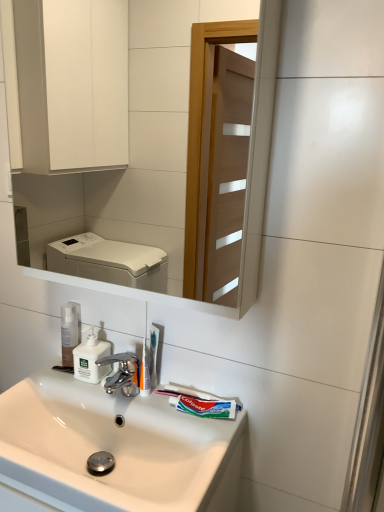
Image resolution: width=384 pixels, height=512 pixels. What do you see at coordinates (70, 331) in the screenshot? I see `transparent plastic pump bottle at center` at bounding box center [70, 331].

At what (x,y) coordinates should I click in order to perform the action: click on transparent plastic pump bottle at center. Please return your answer as a coordinate pair (x, y). Looking at the image, I should click on (70, 331).

Measure the distance between white plastic toothbrush at center, marked as the first toothbrush in a back-to-front arrangement, and camera.

white plastic toothbrush at center, marked as the first toothbrush in a back-to-front arrangement, and camera are 1.14 meters apart from each other.

In the scene shown: Measure the distance between point (158, 335) and camera.

The distance of point (158, 335) from camera is 1.14 meters.

Image resolution: width=384 pixels, height=512 pixels. What do you see at coordinates (144, 374) in the screenshot?
I see `white plastic toothbrush at center, which is the 1th toothbrush from front to back` at bounding box center [144, 374].

Describe the element at coordinates (205, 407) in the screenshot. I see `green matte toothpaste at lower center` at that location.

Find the location of a particular element. transparent plastic pump bottle at center is located at coordinates (70, 331).

Would you consider green matte toothpaste at lower center to be distant from transparent plastic pump bottle at center?

green matte toothpaste at lower center is actually quite close to transparent plastic pump bottle at center.

Considering the relative sizes of green matte toothpaste at lower center and transparent plastic pump bottle at center in the image provided, is green matte toothpaste at lower center smaller than transparent plastic pump bottle at center?

Correct, green matte toothpaste at lower center occupies less space than transparent plastic pump bottle at center.

Does point (216, 401) come in front of point (72, 335)?

That is True.

How distant is green matte toothpaste at lower center from transparent plastic pump bottle at center?

A distance of 38.88 centimeters exists between green matte toothpaste at lower center and transparent plastic pump bottle at center.

Is white glossy mirror at upper center shorter than white glossy sink at lower center?

Incorrect, the height of white glossy mirror at upper center does not fall short of that of white glossy sink at lower center.

Which object is wider, white glossy mirror at upper center or white glossy sink at lower center?

white glossy sink at lower center is wider.

Which is correct: white glossy mirror at upper center is inside white glossy sink at lower center, or outside of it?

white glossy mirror at upper center lies outside white glossy sink at lower center.

From a real-world perspective, relative to white glossy sink at lower center, is white glossy mirror at upper center vertically above or below?

white glossy mirror at upper center is situated higher than white glossy sink at lower center in the real world.

Considering the relative positions of white plastic toothbrush at center, which is the 1th toothbrush from front to back, and transparent plastic pump bottle at center in the image provided, is white plastic toothbrush at center, which is the 1th toothbrush from front to back, to the left or to the right of transparent plastic pump bottle at center?

Based on their positions, white plastic toothbrush at center, which is the 1th toothbrush from front to back, is located to the right of transparent plastic pump bottle at center.

Are white plastic toothbrush at center, which is the 1th toothbrush from front to back, and transparent plastic pump bottle at center located far from each other?

They are positioned close to each other.

From the image's perspective, which one is positioned lower, white plastic toothbrush at center, which is the 1th toothbrush from front to back, or transparent plastic pump bottle at center?

From the image's view, white plastic toothbrush at center, which is the 1th toothbrush from front to back, is below.

Which object is wider, white plastic toothbrush at center, which appears as the 2th toothbrush when viewed from the back, or transparent plastic pump bottle at center?

Wider between the two is transparent plastic pump bottle at center.

Considering the relative sizes of white plastic toothbrush at center, marked as the first toothbrush in a back-to-front arrangement, and white glossy sink at lower center in the image provided, is white plastic toothbrush at center, marked as the first toothbrush in a back-to-front arrangement, wider than white glossy sink at lower center?

No, white plastic toothbrush at center, marked as the first toothbrush in a back-to-front arrangement, is not wider than white glossy sink at lower center.

Between white plastic toothbrush at center, acting as the second toothbrush starting from the front, and white glossy sink at lower center, which one has smaller size?

With smaller size is white plastic toothbrush at center, acting as the second toothbrush starting from the front.

Does point (156, 385) appear closer or farther from the camera than point (132, 492)?

Clearly, point (156, 385) is more distant from the camera than point (132, 492).

From a real-world perspective, is white glossy mirror at upper center positioned under white plastic toothbrush at center, marked as the first toothbrush in a back-to-front arrangement, based on gravity?

No.

Is white glossy mirror at upper center not within white plastic toothbrush at center, marked as the first toothbrush in a back-to-front arrangement?

Yes, white glossy mirror at upper center is not within white plastic toothbrush at center, marked as the first toothbrush in a back-to-front arrangement.

Is white glossy mirror at upper center at the right side of white plastic toothbrush at center, marked as the first toothbrush in a back-to-front arrangement?

Incorrect, white glossy mirror at upper center is not on the right side of white plastic toothbrush at center, marked as the first toothbrush in a back-to-front arrangement.

Which point is more forward, (79, 206) or (152, 387)?

The point (152, 387) is in front.

Is white plastic soap dispenser at center taller than white glossy sink at lower center?

No.

Could you tell me if white plastic soap dispenser at center is facing white glossy sink at lower center?

No.

Can white glossy sink at lower center be found inside white plastic soap dispenser at center?

No, white glossy sink at lower center is located outside of white plastic soap dispenser at center.

Does white plastic soap dispenser at center contain white plastic toothbrush at center, which is the 1th toothbrush from front to back?

No, white plastic toothbrush at center, which is the 1th toothbrush from front to back, is not inside white plastic soap dispenser at center.

The width and height of the screenshot is (384, 512). In order to click on the 2nd toothbrush positioned above the white plastic soap dispenser at center (from a real-world perspective) in this screenshot , I will do `click(144, 374)`.

Considering the relative sizes of white plastic soap dispenser at center and white plastic toothbrush at center, which is the 1th toothbrush from front to back, in the image provided, is white plastic soap dispenser at center bigger than white plastic toothbrush at center, which is the 1th toothbrush from front to back,?

Indeed, white plastic soap dispenser at center has a larger size compared to white plastic toothbrush at center, which is the 1th toothbrush from front to back.

Measure the distance between white plastic soap dispenser at center and white plastic toothbrush at center, which is the 1th toothbrush from front to back.

white plastic soap dispenser at center is 5.46 inches from white plastic toothbrush at center, which is the 1th toothbrush from front to back.

Find the location of a particular element. The width and height of the screenshot is (384, 512). toiletry on the left of green matte toothpaste at lower center is located at coordinates (70, 331).

The width and height of the screenshot is (384, 512). Identify the location of mirror in front of the white glossy sink at lower center. (139, 143).

Based on their spatial positions, is green matte toothpaste at lower center or white glossy sink at lower center further from white plastic toothbrush at center, acting as the second toothbrush starting from the front?

Based on the image, white glossy sink at lower center appears to be further to white plastic toothbrush at center, acting as the second toothbrush starting from the front.

When comparing their distances from white plastic toothbrush at center, which appears as the 2th toothbrush when viewed from the back, does green matte toothpaste at lower center or white plastic toothbrush at center, marked as the first toothbrush in a back-to-front arrangement, seem closer?

Among the two, white plastic toothbrush at center, marked as the first toothbrush in a back-to-front arrangement, is located nearer to white plastic toothbrush at center, which appears as the 2th toothbrush when viewed from the back.

In the scene shown: When comparing their distances from white glossy mirror at upper center, does white plastic toothbrush at center, which is the 1th toothbrush from front to back, or green matte toothpaste at lower center seem further?

green matte toothpaste at lower center.

When comparing their distances from white glossy sink at lower center, does white glossy mirror at upper center or transparent plastic pump bottle at center seem further?

white glossy mirror at upper center is further to white glossy sink at lower center.

Considering their positions, is white plastic toothbrush at center, acting as the second toothbrush starting from the front, positioned closer to white glossy mirror at upper center than white plastic toothbrush at center, which appears as the 2th toothbrush when viewed from the back?

white plastic toothbrush at center, acting as the second toothbrush starting from the front, is positioned closer to the anchor white glossy mirror at upper center.

Considering their positions, is white plastic toothbrush at center, which is the 1th toothbrush from front to back, positioned closer to white glossy sink at lower center than green matte toothpaste at lower center?

The object closer to white glossy sink at lower center is green matte toothpaste at lower center.

From the image, which object appears to be farther from white glossy sink at lower center, green matte toothpaste at lower center or white plastic toothbrush at center, which appears as the 2th toothbrush when viewed from the back?

white plastic toothbrush at center, which appears as the 2th toothbrush when viewed from the back, is positioned further to the anchor white glossy sink at lower center.

When comparing their distances from green matte toothpaste at lower center, does white glossy mirror at upper center or white glossy sink at lower center seem further?

Based on the image, white glossy mirror at upper center appears to be further to green matte toothpaste at lower center.

The image size is (384, 512). Find the location of `toothpaste located between white glossy sink at lower center and white plastic soap dispenser at center in the depth direction`. toothpaste located between white glossy sink at lower center and white plastic soap dispenser at center in the depth direction is located at coordinates (205, 407).

This screenshot has width=384, height=512. Identify the location of toiletry between white glossy mirror at upper center and green matte toothpaste at lower center in the up-down direction. 70,331.

The width and height of the screenshot is (384, 512). I want to click on toiletry between white glossy mirror at upper center and white glossy sink at lower center vertically, so click(70, 331).

Where is `toothpaste between white glossy sink at lower center and transparent plastic pump bottle at center from front to back`? toothpaste between white glossy sink at lower center and transparent plastic pump bottle at center from front to back is located at coordinates (205, 407).